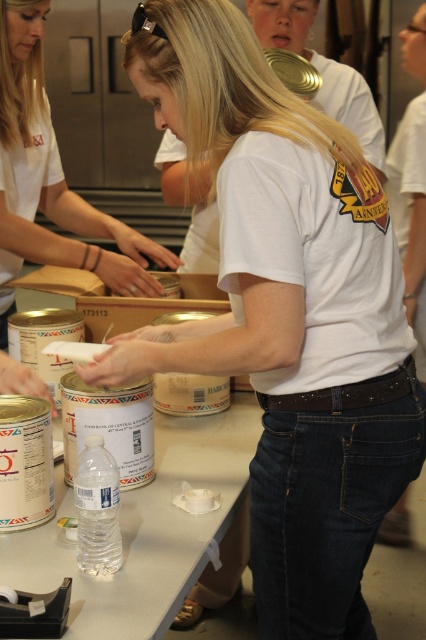
You are standing at the point closest to the woman handling canned goods. Which point, point (238, 456) or point (138, 256), is closer to you?

Point (238, 456) is in front of point (138, 256), so it is closer to you.

You are standing in the food distribution area and need to reach both points. Which point, point (109, 280) or point (264, 8), is closer to you?

Point (109, 280) is closer to you than point (264, 8).